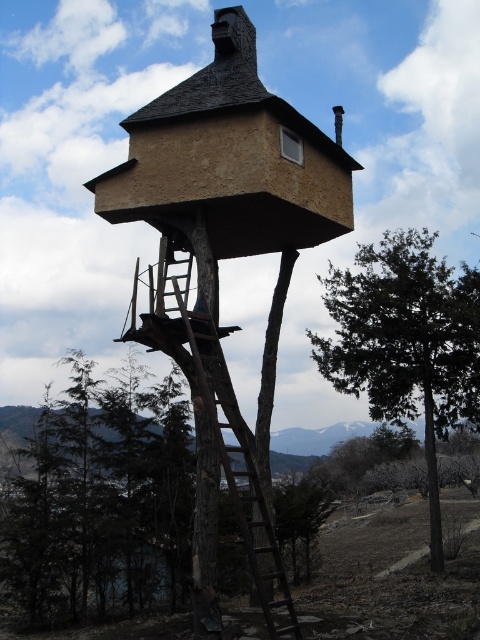
You are planning to paint both the green leafy tree at center and the brown wooden ladder at center. Which object requires more paint to cover its entire width?

The green leafy tree at center requires more paint to cover its entire width because its width surpasses that of the brown wooden ladder at center.

You are planning to climb the brown wooden ladder at center to reach the treehouse. Considering the size of the green leafy tree at center, will the ladder be visible once you are halfway up?

The green leafy tree at center is larger than the brown wooden ladder at center, so once you are halfway up, the ladder might be partially obscured by the tree branches and foliage, making it less visible.

In the scene shown: You are standing at the base of the green leafy tree at center. If you want to reach the treehouse platform, which direction should you look to find the ladder?

The ladder is positioned near the green leafy tree at center, so you should look towards the base of the tree where the ladder is attached to access the platform.